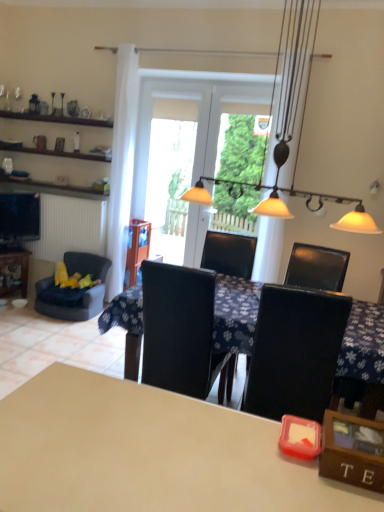
Question: Considering the positions of transparent glass screen door at center, which is the 2th screen door in left-to-right order, and white sheer curtain at left in the image, is transparent glass screen door at center, which is the 2th screen door in left-to-right order, wider or thinner than white sheer curtain at left?

Choices:
 (A) thin
 (B) wide

Answer: (A)

Question: Is transparent glass screen door at center, which is the 2th screen door in left-to-right order, situated inside white sheer curtain at left or outside?

Choices:
 (A) outside
 (B) inside

Answer: (A)

Question: Estimate the real-world distances between objects in this image. Which object is closer to the transparent glass door at center, which is the second screen door from right to left?

Choices:
 (A) white glossy table at center, which ranks as the third table in left-to-right order
 (B) wooden table at left, marked as the 1th table in a back-to-front arrangement
 (C) white sheer curtain at left
 (D) beige matte table at center, acting as the second table starting from the right
 (E) transparent glass screen door at center, the 1th screen door in the right-to-left sequence

Answer: (E)

Question: Considering the real-world distances, which object is closest to the velvet blue armchair at left?

Choices:
 (A) transparent glass screen door at center, which is the 2th screen door in left-to-right order
 (B) transparent glass door at center, which is the first screen door from left to right
 (C) beige matte table at center, which is the first table in front-to-back order
 (D) white sheer curtain at left
 (E) wooden table at left, arranged as the first table when viewed from the left

Answer: (E)